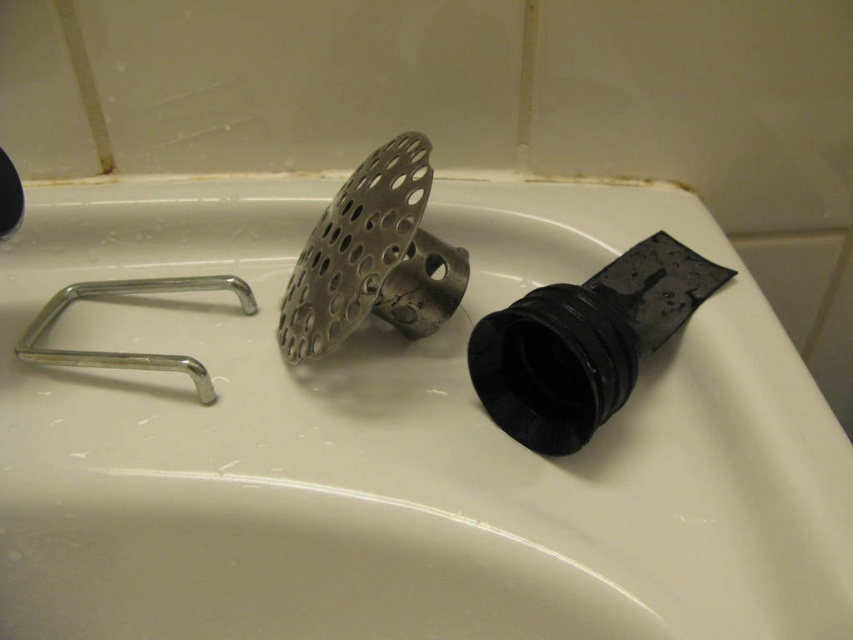
You are trying to place a decorative bowl on the sink. The bowl is as wide as the silver metallic faucet at left. Will it fit entirely on the white matte sink at center?

The white matte sink at center might be wider than the silver metallic faucet at left, so the decorative bowl, which is as wide as the faucet, could potentially fit on the sink. However, since the sink might be wider, it depends on the exact dimensions. If the sink is indeed wider, the bowl should fit without overhanging.

What are the coordinates of the white matte sink at center?

The white matte sink at center is located at coordinates point [397,442].

You are trying to clean the bathroom sink area. You have a sponge and want to reach both the white matte sink at center and the silver metallic faucet at left. Since the sink is in front of the faucet, will the sponge need to be moved around the sink to reach the faucet?

The white matte sink at center is in front of the silver metallic faucet at left, so to reach the faucet, you would need to move the sponge around the sink.